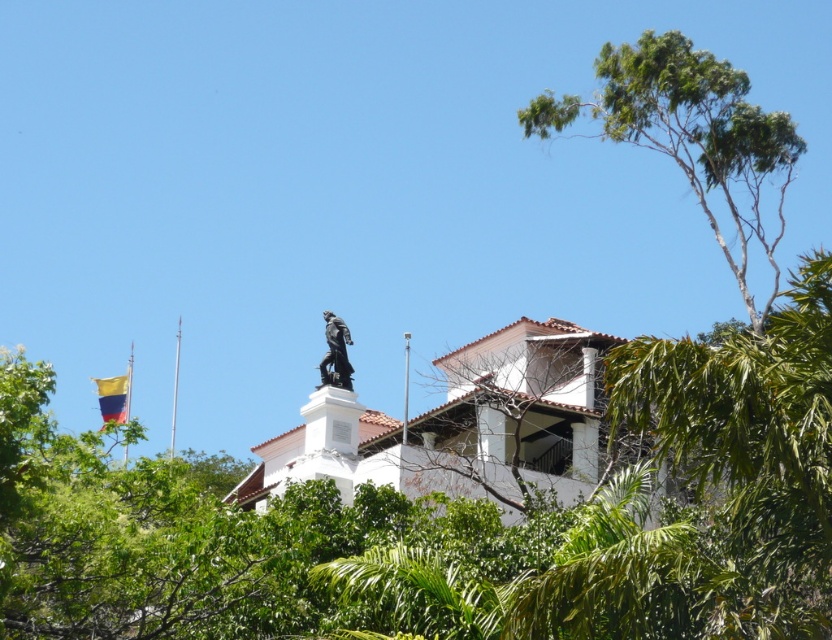
Question: Among these points, which one is nearest to the camera?

Choices:
 (A) (107, 406)
 (B) (677, 115)
 (C) (171, 412)

Answer: (B)

Question: Is green leafy tree at upper right to the right of yellow fabric flag at upper left from the viewer's perspective?

Choices:
 (A) no
 (B) yes

Answer: (B)

Question: From the image, what is the correct spatial relationship of green leafy tree at upper center in relation to yellow fabric flag at upper left?

Choices:
 (A) right
 (B) left

Answer: (A)

Question: Which point is closer to the camera?

Choices:
 (A) (427, 531)
 (B) (790, 116)
 (C) (348, 378)
 (D) (171, 440)

Answer: (A)

Question: Can you confirm if green leafy tree at upper center is positioned to the right of green leafy tree at upper right?

Choices:
 (A) no
 (B) yes

Answer: (A)

Question: Which of the following is the farthest from the observer?

Choices:
 (A) yellow fabric flag at upper left
 (B) green leafy tree at upper right
 (C) green leafy tree at upper center
 (D) polished bronze statue at upper center

Answer: (A)